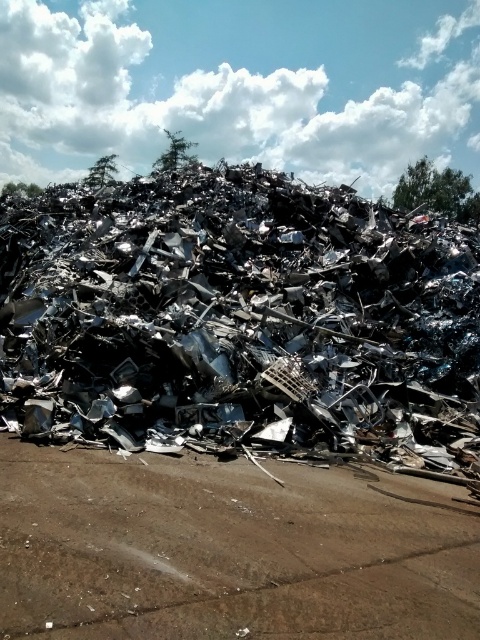
Question: Which of the following is the closest to the observer?

Choices:
 (A) (207, 465)
 (B) (290, 211)

Answer: (A)

Question: Among these objects, which one is nearest to the camera?

Choices:
 (A) brown dirt track at center
 (B) metallic debris at center

Answer: (A)

Question: Does metallic debris at center appear over brown dirt track at center?

Choices:
 (A) no
 (B) yes

Answer: (B)

Question: Does metallic debris at center have a lesser width compared to brown dirt track at center?

Choices:
 (A) yes
 (B) no

Answer: (B)

Question: Does metallic debris at center appear on the left side of brown dirt track at center?

Choices:
 (A) no
 (B) yes

Answer: (A)